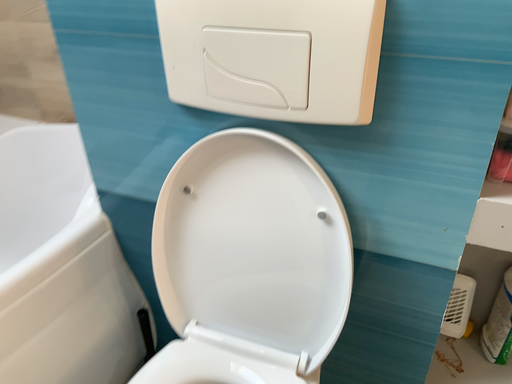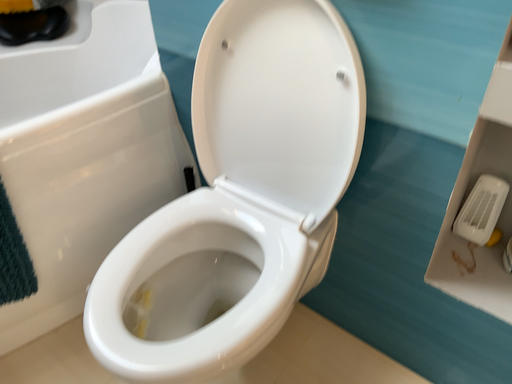
Question: How did the camera likely rotate when shooting the video?

Choices:
 (A) rotated upward
 (B) rotated downward

Answer: (B)